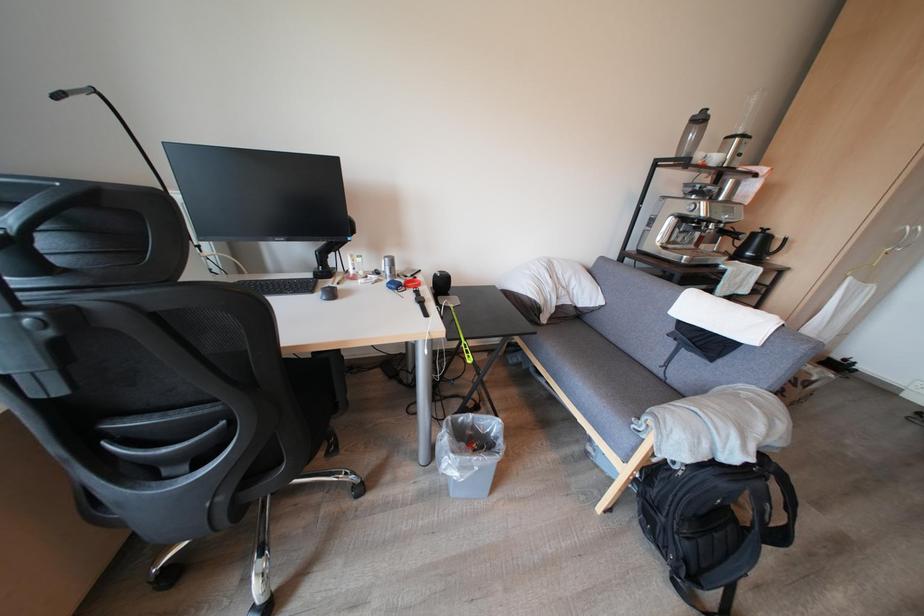
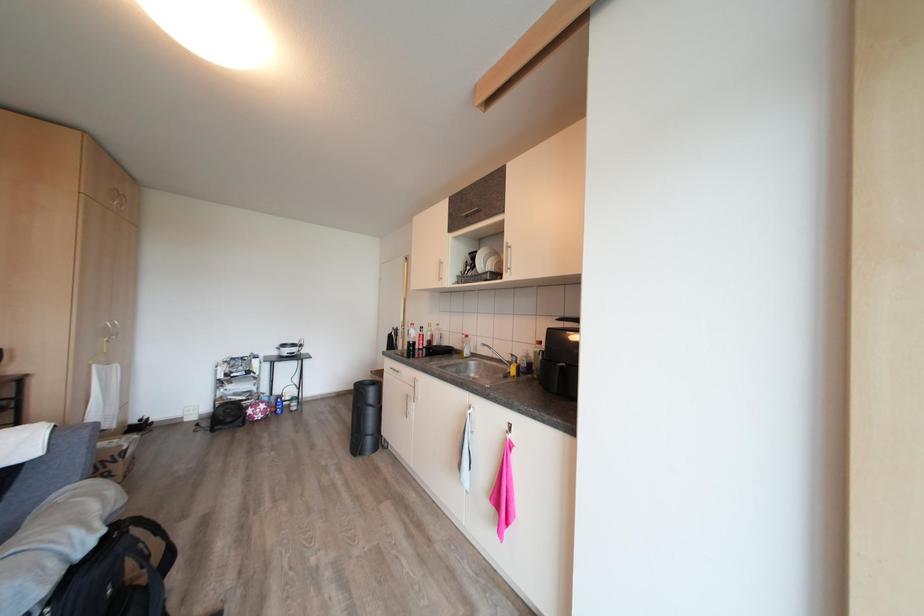
Question: How did the camera likely rotate?

Choices:
 (A) Left
 (B) Right
 (C) Up
 (D) Down

Answer: (B)